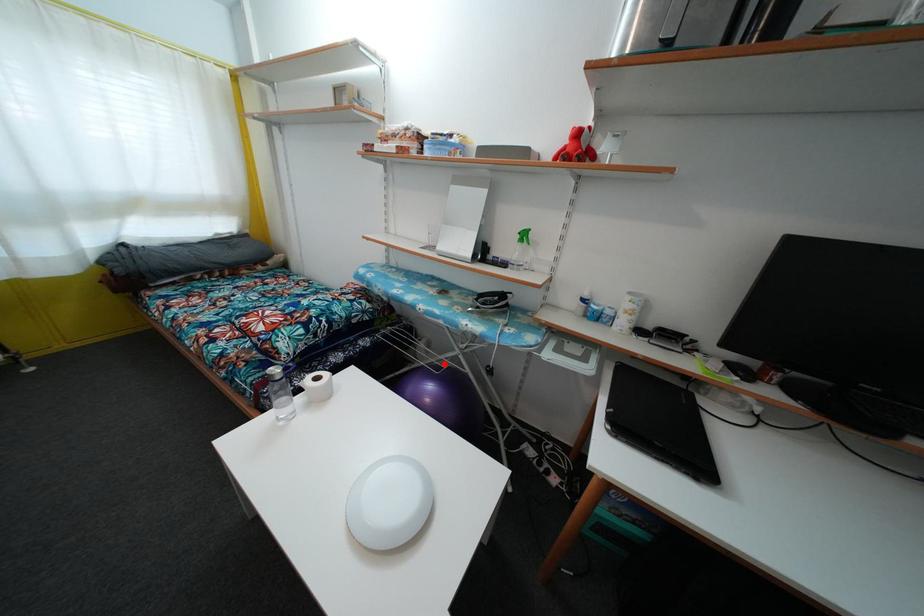
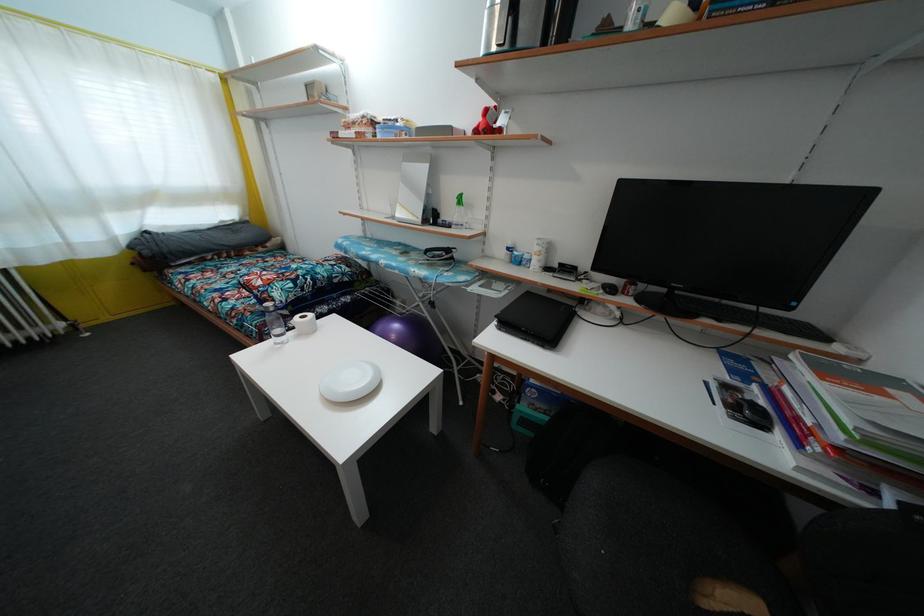
Question: I am providing you with two images of the same scene from different viewpoints. A red point is marked on the first image. At the location where the point appears in image 1, is it still visible in image 2?

Choices:
 (A) Yes
 (B) No

Answer: (A)